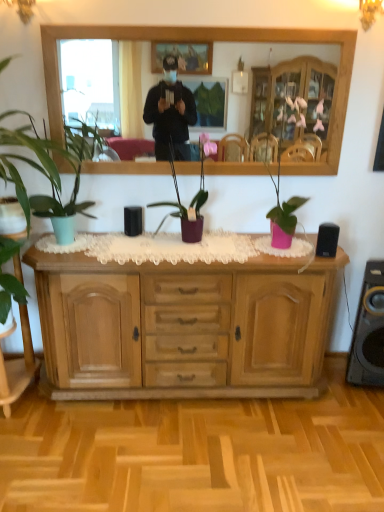
The width and height of the screenshot is (384, 512). In order to click on vacant space in front of light brown wood cabinet at center in this screenshot , I will do `click(189, 453)`.